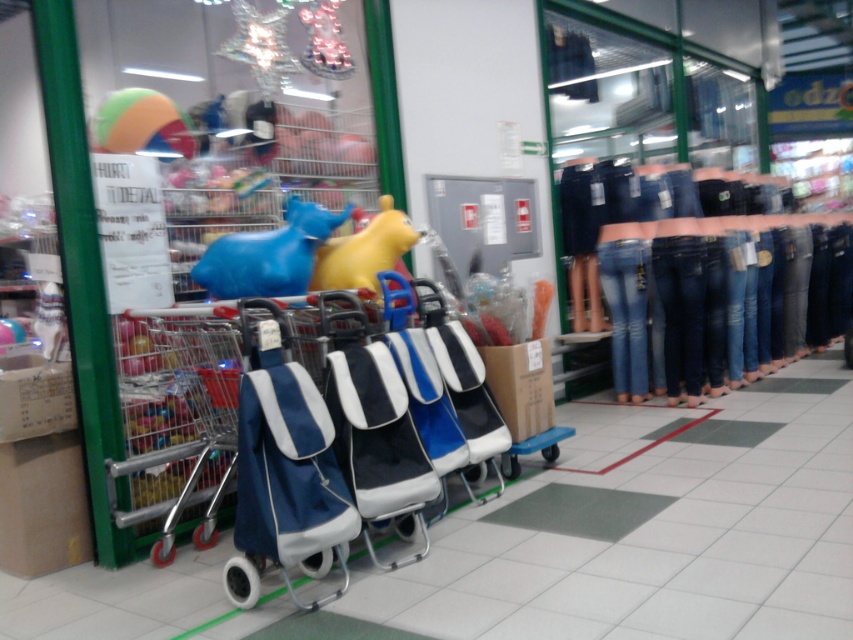
From the picture: You are a customer in the store and want to pick up the blue rubber horse at center and the denim at center. Which item will you reach first?

The blue rubber horse at center is closer to you than the denim at center, so you will reach the blue rubber horse at center first.

You are standing in the retail store and see the blue rubber horse at center. If you take two steps forward, will you be closer to it than 2 meters?

The blue rubber horse at center is 2.90 meters away from viewer. Taking two steps forward would reduce the distance, but unless each step covers at least 0.5 meters, you might still be more than 2 meters away. However, average step length is about 0.76 meters, so two steps would bring you to approximately 2.90 minus 1.52 meters equals 1.38 meters, which is closer than 2 meters.